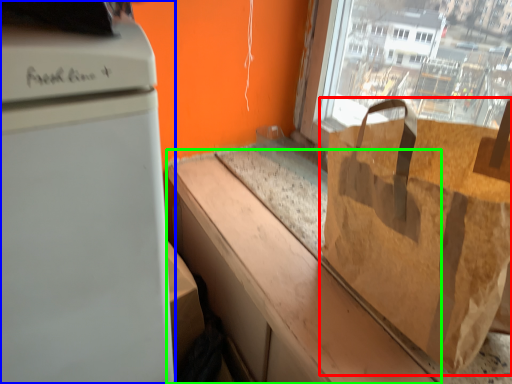
Question: Considering the real-world distances, which object is closest to grocery bag (highlighted by a red box)? home appliance (highlighted by a blue box) or counter top (highlighted by a green box).

Choices:
 (A) home appliance
 (B) counter top

Answer: (B)